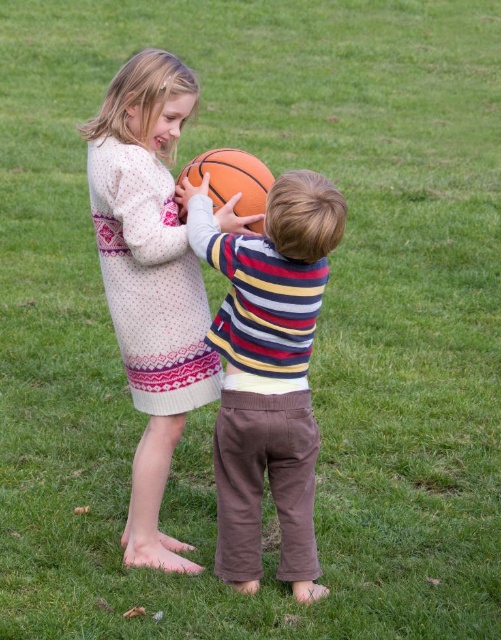
Does knitted sweater at center have a lesser width compared to orange textured basketball at center?

In fact, knitted sweater at center might be wider than orange textured basketball at center.

Is point (202, 301) positioned in front of point (261, 230)?

That is False.

Find the location of a particular element. Image resolution: width=501 pixels, height=640 pixels. knitted sweater at center is located at coordinates (149, 280).

The image size is (501, 640). I want to click on matte striped sweater at center, so click(x=268, y=372).

Which of these two, matte striped sweater at center or orange textured basketball at center, stands shorter?

With less height is orange textured basketball at center.

Who is more forward, (247, 294) or (237, 170)?

Point (247, 294)

Locate an element on the screen. This screenshot has width=501, height=640. matte striped sweater at center is located at coordinates (268, 372).

Is point (274, 184) positioned behind point (100, 253)?

No, it is in front of (100, 253).

Does matte striped sweater at center appear over knitted sweater at center?

Incorrect, matte striped sweater at center is not positioned above knitted sweater at center.

Does point (320, 592) come behind point (138, 401)?

No, (320, 592) is closer to viewer.

Where is `matte striped sweater at center`? The image size is (501, 640). matte striped sweater at center is located at coordinates pos(268,372).